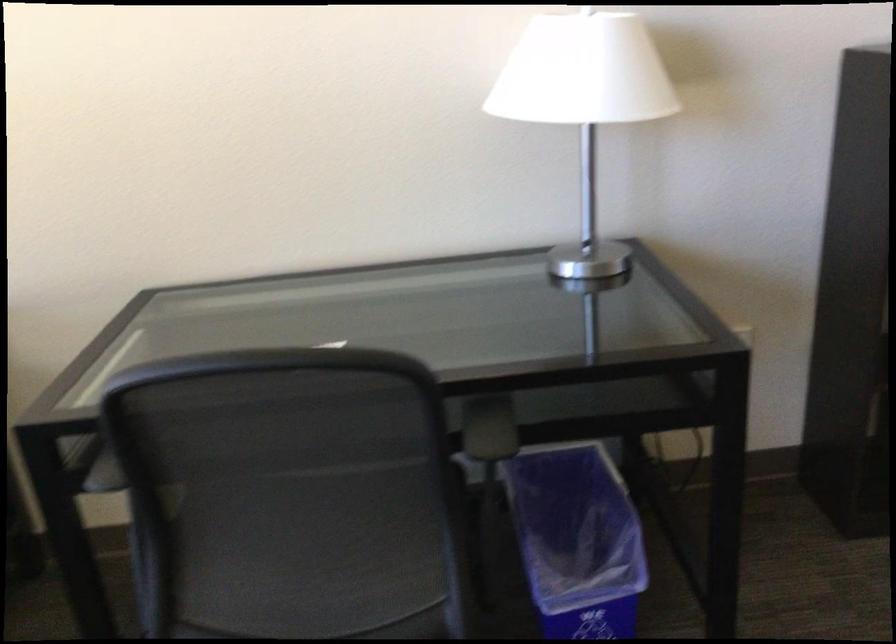
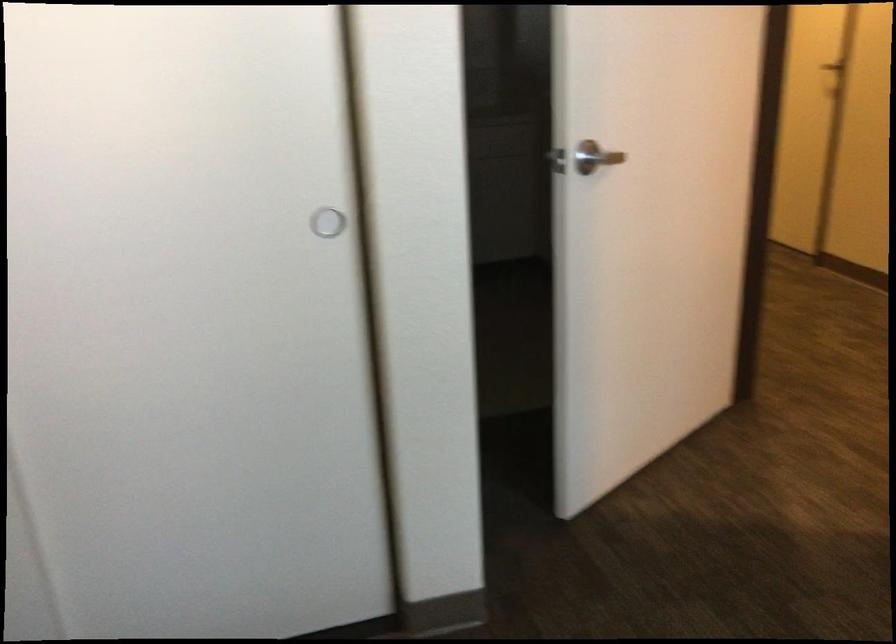
How did the camera likely rotate?

The camera's rotation is toward right-down.